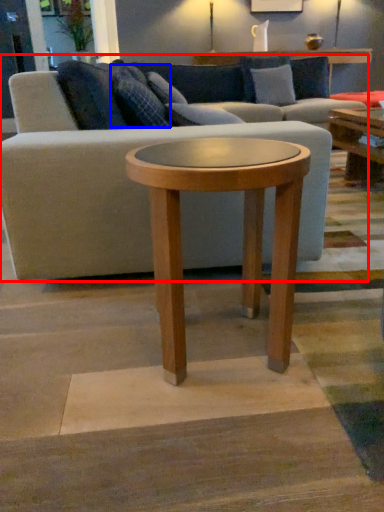
Question: Which object is closer to the camera taking this photo, studio couch (highlighted by a red box) or pillow (highlighted by a blue box)?

Choices:
 (A) studio couch
 (B) pillow

Answer: (A)